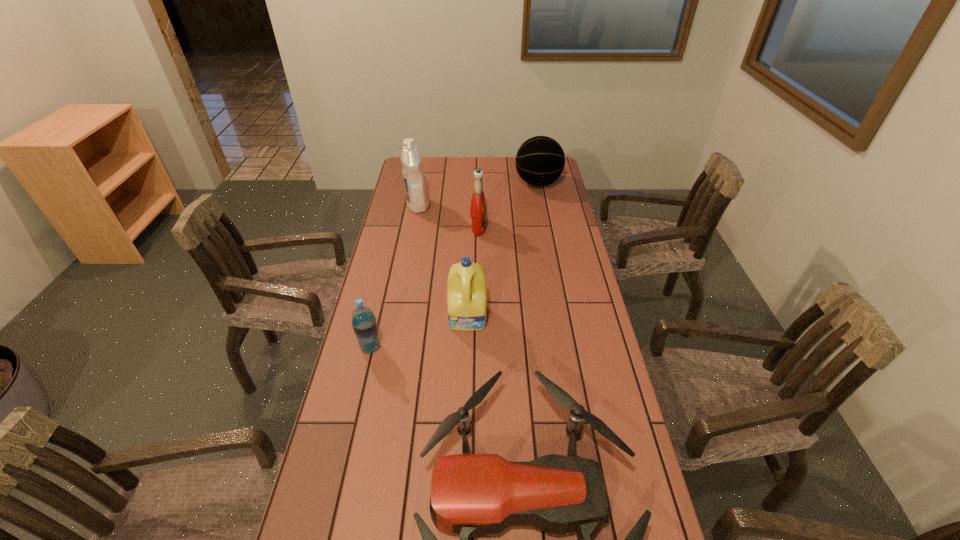
You are a GUI agent. You are given a task and a screenshot of the screen. Output one action in this format:
    pyautogui.click(x=<x>, y=<y>)
    Task: Click on the vacant space located 0.350m on the right of the water bottle
    The height and width of the screenshot is (540, 960).
    Given the screenshot: What is the action you would take?
    pyautogui.click(x=501, y=347)

This screenshot has height=540, width=960. Find the location of `object situated at the far edge`. object situated at the far edge is located at coordinates (540, 160).

You are a GUI agent. You are given a task and a screenshot of the screen. Output one action in this format:
    pyautogui.click(x=<x>, y=<y>)
    Task: Click on the detergent that is positioned at the left edge
    
    Given the screenshot: What is the action you would take?
    pyautogui.click(x=413, y=172)

Identify the location of water bottle present at the left edge. (364, 323).

What are the coordinates of `object at the right edge` in the screenshot? It's located at (540, 160).

In order to click on object present at the far right corner in this screenshot , I will do `click(540, 160)`.

Where is `free space at the far edge of the desktop`? The width and height of the screenshot is (960, 540). free space at the far edge of the desktop is located at coordinates (508, 180).

Where is `vacant space at the left edge of the desktop`? The height and width of the screenshot is (540, 960). vacant space at the left edge of the desktop is located at coordinates (360, 424).

Where is `free space at the right edge of the desktop`? This screenshot has height=540, width=960. free space at the right edge of the desktop is located at coordinates (589, 393).

Where is `free spot between the second nearest object and the third nearest object`? The image size is (960, 540). free spot between the second nearest object and the third nearest object is located at coordinates coord(420,333).